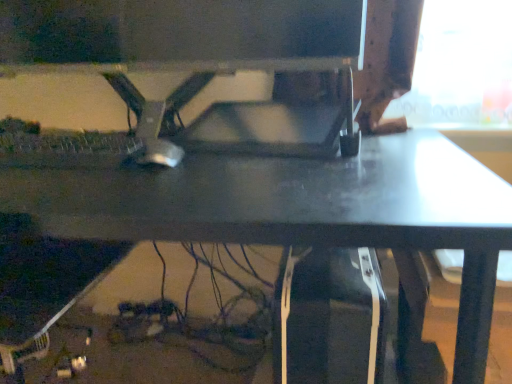
Question: From the image's perspective, relative to matte black desk at center, is matte black monitor at center above or below?

Choices:
 (A) above
 (B) below

Answer: (A)

Question: Is point (349, 46) positioned closer to the camera than point (508, 240)?

Choices:
 (A) closer
 (B) farther

Answer: (B)

Question: Which of these objects is positioned farthest from the matte black desk at center?

Choices:
 (A) silver metallic mouse at center
 (B) matte black monitor at center

Answer: (B)

Question: Considering the real-world distances, which object is closest to the matte black desk at center?

Choices:
 (A) silver metallic mouse at center
 (B) matte black monitor at center

Answer: (A)